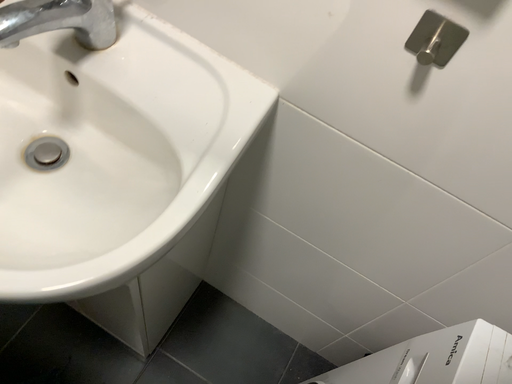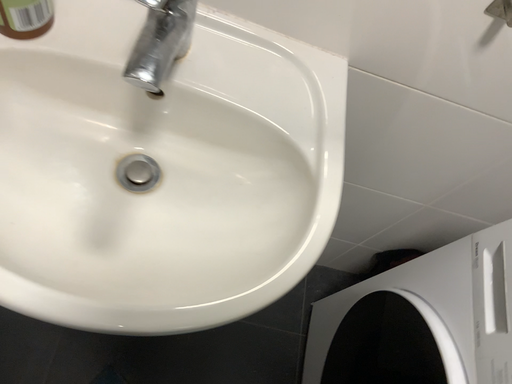
Question: Which way did the camera rotate in the video?

Choices:
 (A) rotated right
 (B) rotated left

Answer: (A)